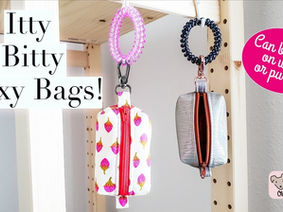
You are a GUI agent. You are given a task and a screenshot of the screen. Output one action in this format:
    pyautogui.click(x=<x>, y=<y>)
    Task: Click on the tan wood leg
    The width and height of the screenshot is (283, 212).
    Given the screenshot: What is the action you would take?
    pyautogui.click(x=96, y=67)